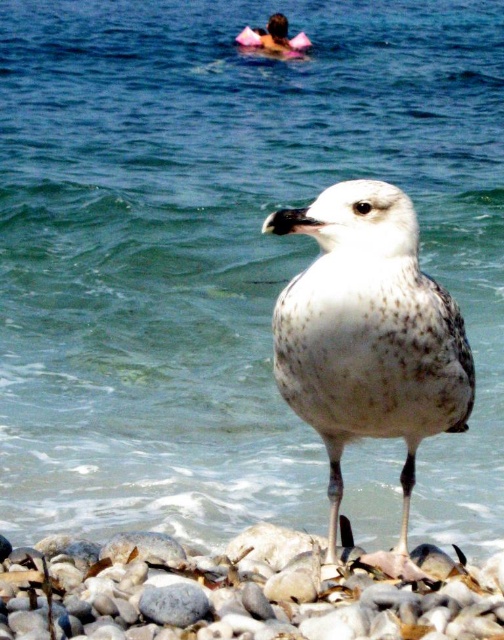
What do you see at coordinates (238, 592) in the screenshot? I see `smooth gray rock at lower center` at bounding box center [238, 592].

Is smooth gray rock at lower center behind white speckled feathered bird at center?

Yes, smooth gray rock at lower center is further from the viewer.

The height and width of the screenshot is (640, 504). In order to click on smooth gray rock at lower center in this screenshot , I will do `click(238, 592)`.

Image resolution: width=504 pixels, height=640 pixels. What are the coordinates of `smooth gray rock at lower center` in the screenshot? It's located at (238, 592).